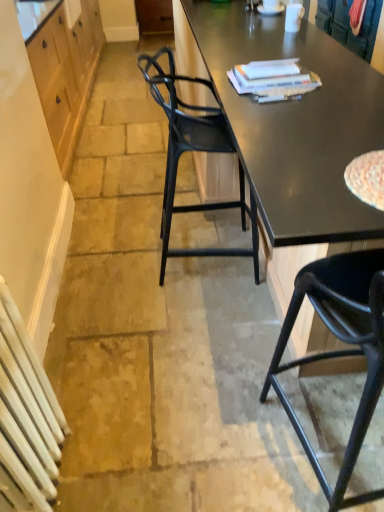
Image resolution: width=384 pixels, height=512 pixels. Identify the location of free space that is to the left of black plastic chair at lower right, placed as the 1th chair when sorted from front to back. (191, 433).